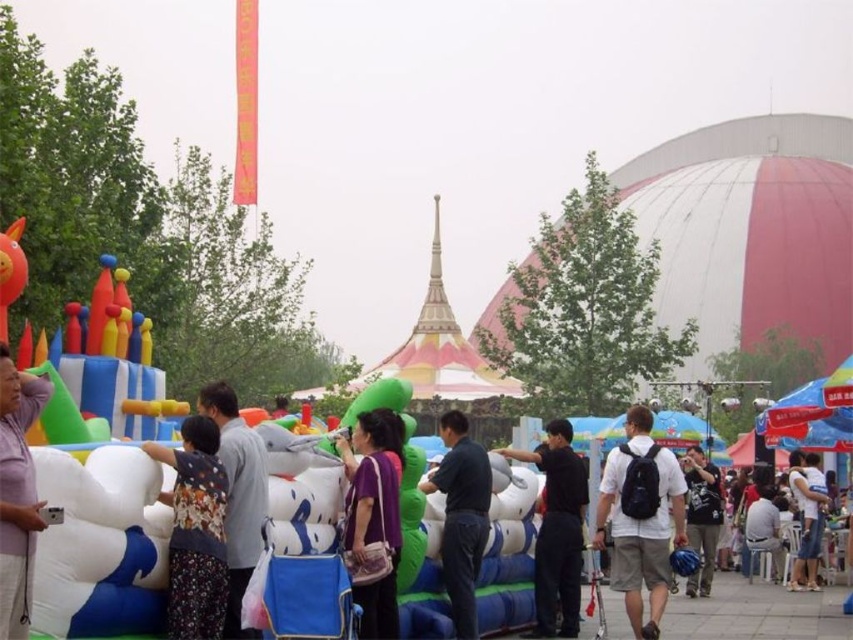
Can you confirm if dark blue backpack at center is smaller than white cotton shirt at center?

Yes, dark blue backpack at center is smaller than white cotton shirt at center.

Locate an element on the screen. dark blue backpack at center is located at coordinates (701, 516).

Is point (705, 496) less distant than point (791, 589)?

That is False.

This screenshot has height=640, width=853. Identify the location of dark blue backpack at center. (701, 516).

Is point (4, 496) closer to viewer compared to point (796, 476)?

Yes, it is in front of point (796, 476).

Consider the image. Does pink matte shirt at left have a greater width compared to white cotton shirt at center?

Incorrect, pink matte shirt at left's width does not surpass white cotton shirt at center's.

Is point (16, 449) closer to camera compared to point (804, 577)?

That is True.

This screenshot has height=640, width=853. Identify the location of pink matte shirt at left. (16, 493).

Can you confirm if floral dress at center is wider than white cotton shirt at center?

Incorrect, floral dress at center's width does not surpass white cotton shirt at center's.

The image size is (853, 640). Find the location of `floral dress at center`. floral dress at center is located at coordinates [x=195, y=531].

Identify the location of floral dress at center. (195, 531).